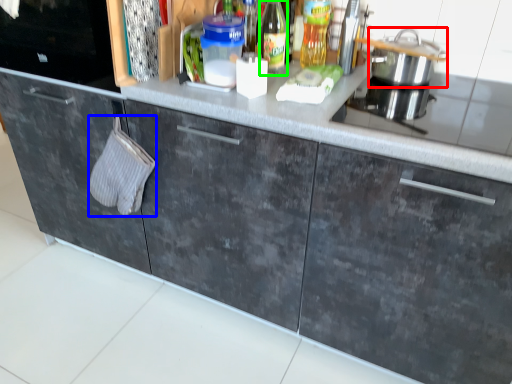
Question: Based on their relative distances, which object is nearer to kitchen appliance (highlighted by a red box)? Choose from hand towel (highlighted by a blue box) and bottle (highlighted by a green box).

Choices:
 (A) hand towel
 (B) bottle

Answer: (B)